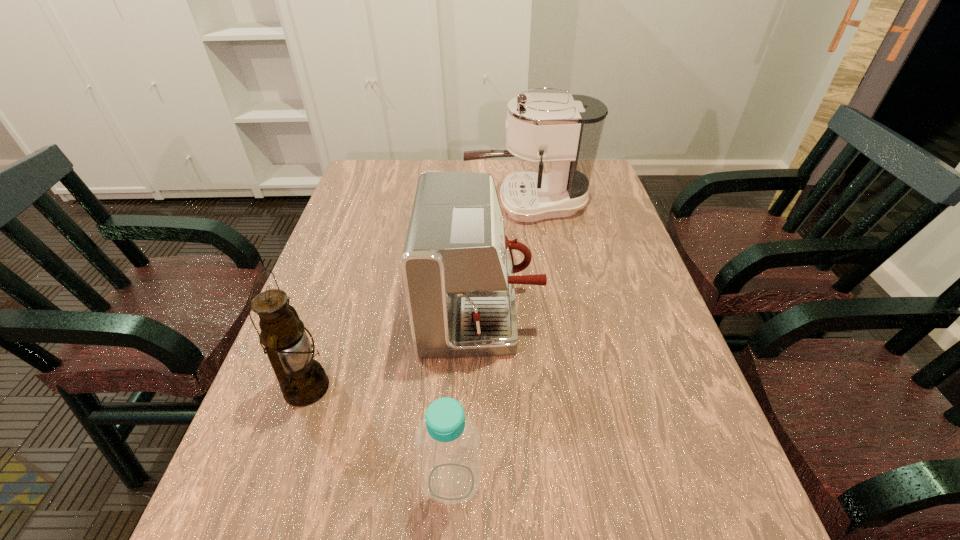
Identify the location of free location located 0.320m on the back of the shortest object. Image resolution: width=960 pixels, height=540 pixels. (459, 323).

Where is `object that is at the far edge`? object that is at the far edge is located at coordinates point(564,130).

This screenshot has width=960, height=540. Identify the location of object located at the left edge. (303, 381).

At what (x,y) coordinates should I click in order to perform the action: click on object that is at the right edge. Please return your answer as a coordinate pair (x, y). Looking at the image, I should click on (564, 130).

At what (x,y) coordinates should I click in order to perform the action: click on object at the far right corner. Please return your answer as a coordinate pair (x, y). The width and height of the screenshot is (960, 540). Looking at the image, I should click on (564, 130).

I want to click on vacant space at the far edge of the desktop, so click(x=476, y=167).

The height and width of the screenshot is (540, 960). What are the coordinates of `free region at the near edge of the desktop` in the screenshot? It's located at (507, 536).

Image resolution: width=960 pixels, height=540 pixels. In the image, there is a desktop. Identify the location of vacant region at the left edge. (343, 238).

Locate an element on the screen. The width and height of the screenshot is (960, 540). vacant space at the right edge of the desktop is located at coordinates (664, 511).

Find the location of a particular element. vacant space at the far right corner is located at coordinates (600, 174).